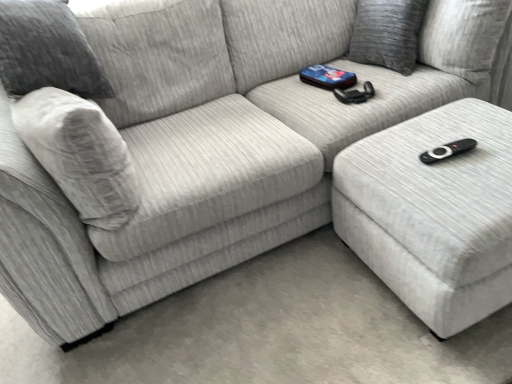
What do you see at coordinates (433, 213) in the screenshot? Image resolution: width=512 pixels, height=384 pixels. I see `white fabric ottoman at lower right` at bounding box center [433, 213].

In the scene shown: In order to face white fabric ottoman at lower right, should I rotate leftwards or rightwards?

Rotate your view right by about 25.124°.

Measure the distance between point [486,144] and camera.

They are 4.06 feet apart.

Where is `white fabric ottoman at lower right`? white fabric ottoman at lower right is located at coordinates (433, 213).

The height and width of the screenshot is (384, 512). What do you see at coordinates (387, 33) in the screenshot?
I see `gray fabric pillow at upper right` at bounding box center [387, 33].

The width and height of the screenshot is (512, 384). What are the coordinates of `gray fabric pillow at upper right` in the screenshot? It's located at (387, 33).

Identify the location of white fabric ottoman at lower right. (433, 213).

Does white fabric ottoman at lower right appear on the left side of gray fabric pillow at upper right?

No.

Looking at this image, between white fabric ottoman at lower right and gray fabric pillow at upper right, which one is positioned in front?

white fabric ottoman at lower right.

Considering the points (369, 168) and (417, 43), which point is behind, point (369, 168) or point (417, 43)?

The point (417, 43) is behind.

From the image's perspective, does white fabric ottoman at lower right appear lower than gray fabric pillow at upper right?

Yes, from the image's perspective, white fabric ottoman at lower right is beneath gray fabric pillow at upper right.

From a real-world perspective, is white fabric ottoman at lower right over gray fabric pillow at upper right?

No, from a real-world perspective, white fabric ottoman at lower right is not on top of gray fabric pillow at upper right.

Considering the sizes of white fabric ottoman at lower right and gray fabric pillow at upper right in the image, is white fabric ottoman at lower right wider or thinner than gray fabric pillow at upper right?

Considering their sizes, white fabric ottoman at lower right looks broader than gray fabric pillow at upper right.

Based on the photo, considering the relative sizes of white fabric ottoman at lower right and gray fabric pillow at upper right in the image provided, is white fabric ottoman at lower right shorter than gray fabric pillow at upper right?

Incorrect, the height of white fabric ottoman at lower right does not fall short of that of gray fabric pillow at upper right.

Is white fabric ottoman at lower right smaller than gray fabric pillow at upper right?

Incorrect, white fabric ottoman at lower right is not smaller in size than gray fabric pillow at upper right.

Is white fabric ottoman at lower right not inside gray fabric pillow at upper right?

Yes, white fabric ottoman at lower right is not within gray fabric pillow at upper right.

Can you see white fabric ottoman at lower right touching gray fabric pillow at upper right?

white fabric ottoman at lower right and gray fabric pillow at upper right are clearly separated.

From the picture: Is white fabric ottoman at lower right facing towards gray fabric pillow at upper right?

No.

Can you tell me how much white fabric ottoman at lower right and gray fabric pillow at upper right differ in facing direction?

88 degrees separate the facing orientations of white fabric ottoman at lower right and gray fabric pillow at upper right.

How far apart are white fabric ottoman at lower right and gray fabric pillow at upper right?

A distance of 23.20 inches exists between white fabric ottoman at lower right and gray fabric pillow at upper right.

The width and height of the screenshot is (512, 384). I want to click on table that appears in front of the gray fabric pillow at upper right, so click(x=433, y=213).

Which is more to the right, gray fabric pillow at upper right or white fabric ottoman at lower right?

white fabric ottoman at lower right.

Does gray fabric pillow at upper right come behind white fabric ottoman at lower right?

Yes, it is.

Between point (401, 41) and point (383, 185), which one is positioned behind?

The point (401, 41) is farther from the camera.

From the image's perspective, does gray fabric pillow at upper right appear lower than white fabric ottoman at lower right?

Incorrect, from the image's perspective, gray fabric pillow at upper right is higher than white fabric ottoman at lower right.

From a real-world perspective, does gray fabric pillow at upper right stand above white fabric ottoman at lower right?

Yes.

Between gray fabric pillow at upper right and white fabric ottoman at lower right, which one has smaller width?

With smaller width is gray fabric pillow at upper right.

Between gray fabric pillow at upper right and white fabric ottoman at lower right, which one has more height?

white fabric ottoman at lower right.

Between gray fabric pillow at upper right and white fabric ottoman at lower right, which one has smaller size?

gray fabric pillow at upper right.

Is gray fabric pillow at upper right inside or outside of white fabric ottoman at lower right?

gray fabric pillow at upper right is outside white fabric ottoman at lower right.

Is gray fabric pillow at upper right not close to white fabric ottoman at lower right?

No, gray fabric pillow at upper right is not far away from white fabric ottoman at lower right.

Could you tell me if gray fabric pillow at upper right is facing white fabric ottoman at lower right?

No, gray fabric pillow at upper right is not turned towards white fabric ottoman at lower right.

Can you tell me how much gray fabric pillow at upper right and white fabric ottoman at lower right differ in facing direction?

There is a 88-degree angle between the facing directions of gray fabric pillow at upper right and white fabric ottoman at lower right.

Locate an element on the screen. table below the gray fabric pillow at upper right (from a real-world perspective) is located at coordinates [x=433, y=213].

Find the location of `table lying in front of the gray fabric pillow at upper right`. table lying in front of the gray fabric pillow at upper right is located at coordinates pyautogui.click(x=433, y=213).

The image size is (512, 384). In order to click on table to the right of gray fabric pillow at upper right in this screenshot , I will do `click(433, 213)`.